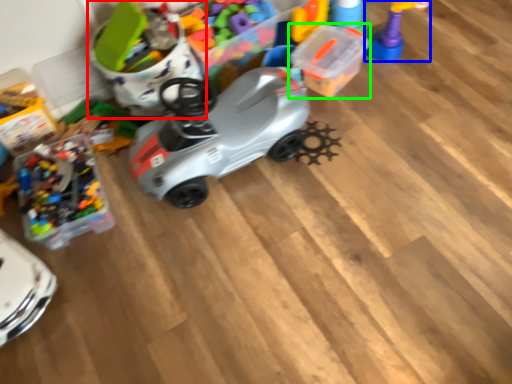
Question: Based on their relative distances, which object is nearer to toy (highlighted by a red box)? Choose from toy (highlighted by a blue box) and toy (highlighted by a green box).

Choices:
 (A) toy
 (B) toy

Answer: (B)